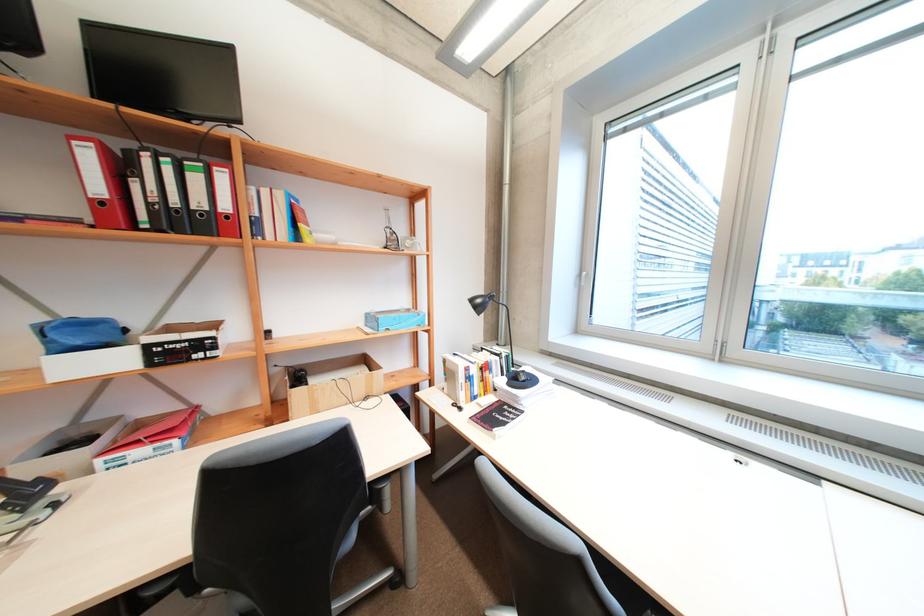
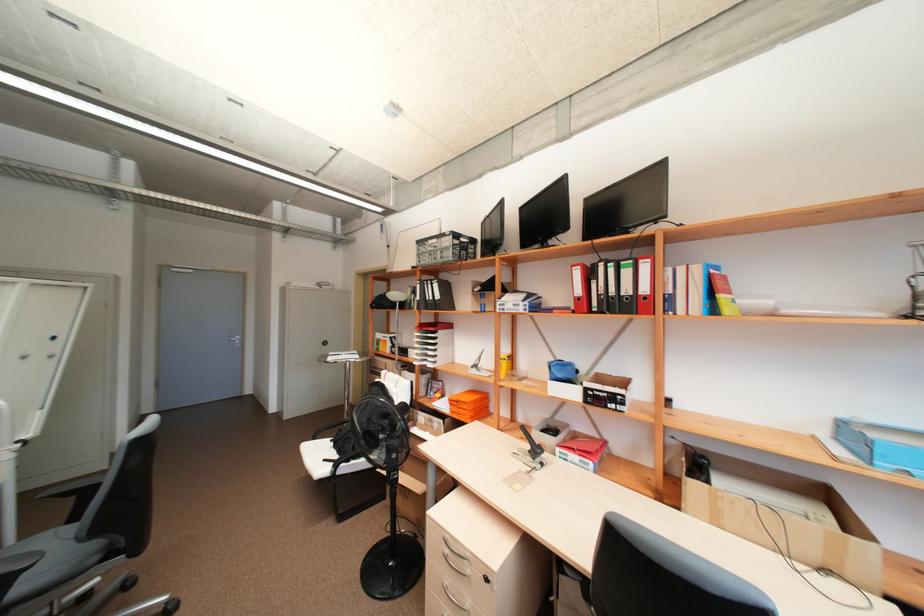
Locate, in the second image, the point that corresponds to (x=104, y=188) in the first image.

(584, 291)